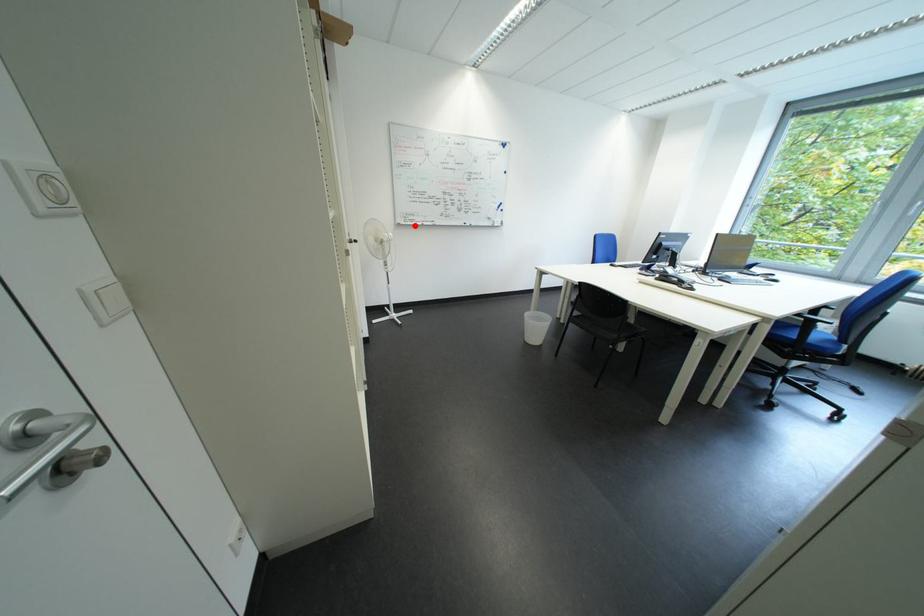
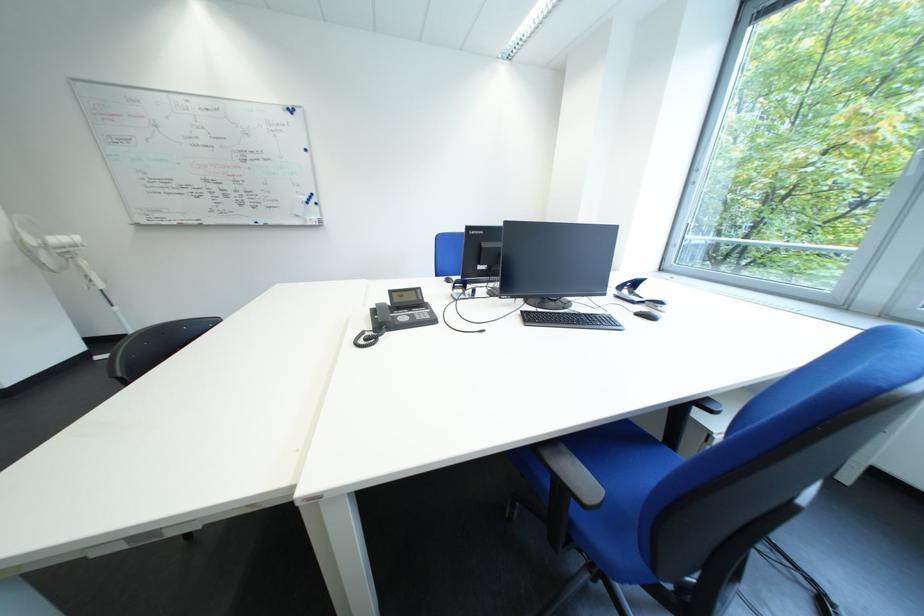
Find the pixel in the second image that matches the highlighted location in the first image.

(157, 225)